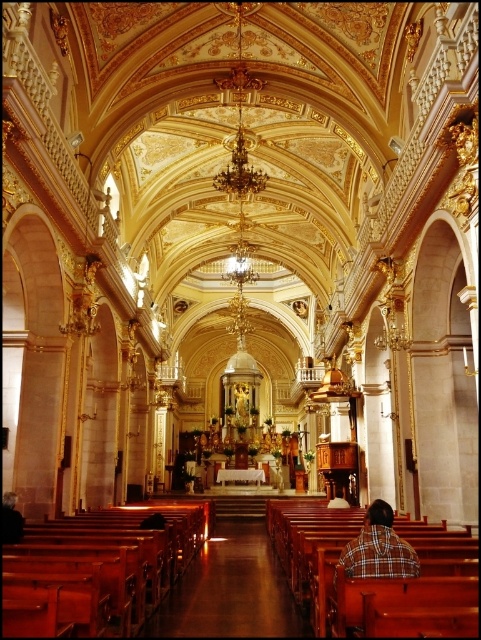
You are a visitor entering the church and notice a plaid shirt at center and a wooden bench at center. Which object is bigger in size?

The plaid shirt at center has a larger size compared to the wooden bench at center, so the plaid shirt at center is bigger.

You are an interior designer planning to install a new lighting fixture in the church. You need to ensure it is tall enough to avoid touching the plaid shirt at center and the wooden bench at center. Which object should determine the minimum height requirement for the lighting fixture?

The plaid shirt at center has a greater height compared to the wooden bench at center. Therefore, the minimum height requirement for the lighting fixture should be based on the plaid shirt at center to ensure it doesn not touch either object.